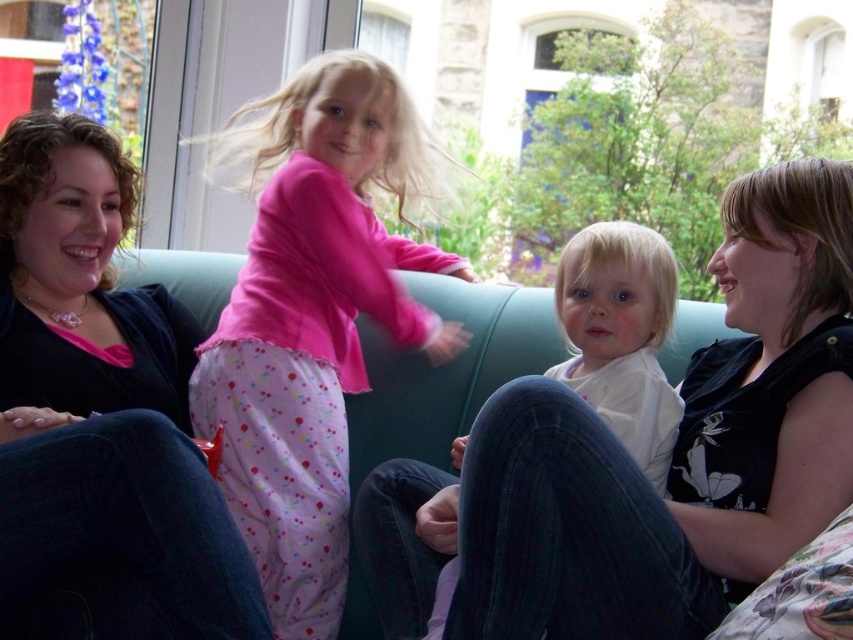
Consider the image. You are an interior designer planning to place a new decorative item on the sofa where the matte black sweater at left is located. The sofa has a coordinate system where the bottom left corner is at point 0,0 and the top right corner is at point 1,1. Where exactly should you place the new item to match the sweater?

Place the new decorative item at the coordinates (103, 394) on the sofa to match the location of the matte black sweater at left.

You are a photographer setting up a shoot in this living room. You need to place a 1.2 meter tall tripod between the green fabric couch at center and the white soft fabric at center. Based on their heights, will the tripod be taller than both objects?

The green fabric couch at center is much taller than the white soft fabric at center. Since the couch is already taller than the white fabric, the tripod at 1.2 meters would need to be compared to the couch. If the couch is taller than 1.2 meters, the tripod would be shorter. However, without specific measurements, we can only state that the tripod may or may not be taller than both depending on the couch height. But according to the description, the couch is much taller than the white fabric, so if the tri